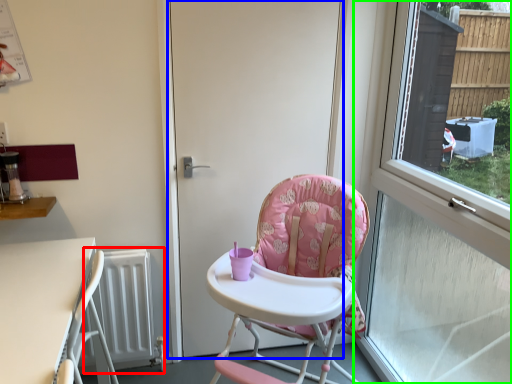
Question: Considering the real-world distances, which object is closest to radiator (highlighted by a red box)? door (highlighted by a blue box) or window (highlighted by a green box).

Choices:
 (A) door
 (B) window

Answer: (A)